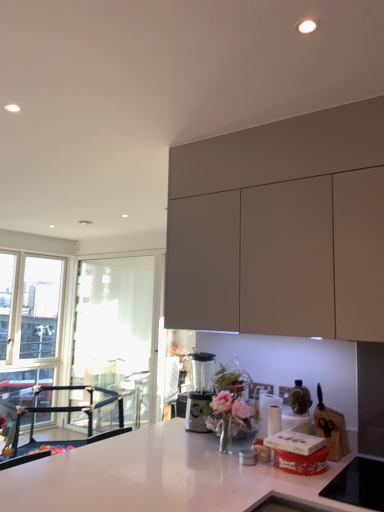
Question: Considering the positions of white glossy countertop at center and shiny metallic bottle at center in the image, is white glossy countertop at center bigger or smaller than shiny metallic bottle at center?

Choices:
 (A) small
 (B) big

Answer: (B)

Question: Looking at their shapes, would you say white glossy countertop at center is wider or thinner than shiny metallic bottle at center?

Choices:
 (A) wide
 (B) thin

Answer: (A)

Question: Considering the real-world distances, which object is closest to the matte gray cabinet at upper right?

Choices:
 (A) shiny metallic bottle at center
 (B) transparent glass window screen at left
 (C) sleek metallic blender at center
 (D) white glossy countertop at center

Answer: (A)

Question: Which of these objects is positioned closest to the shiny metallic bottle at center?

Choices:
 (A) sleek metallic blender at center
 (B) transparent glass window screen at left
 (C) matte gray cabinet at upper right
 (D) white glossy countertop at center

Answer: (A)